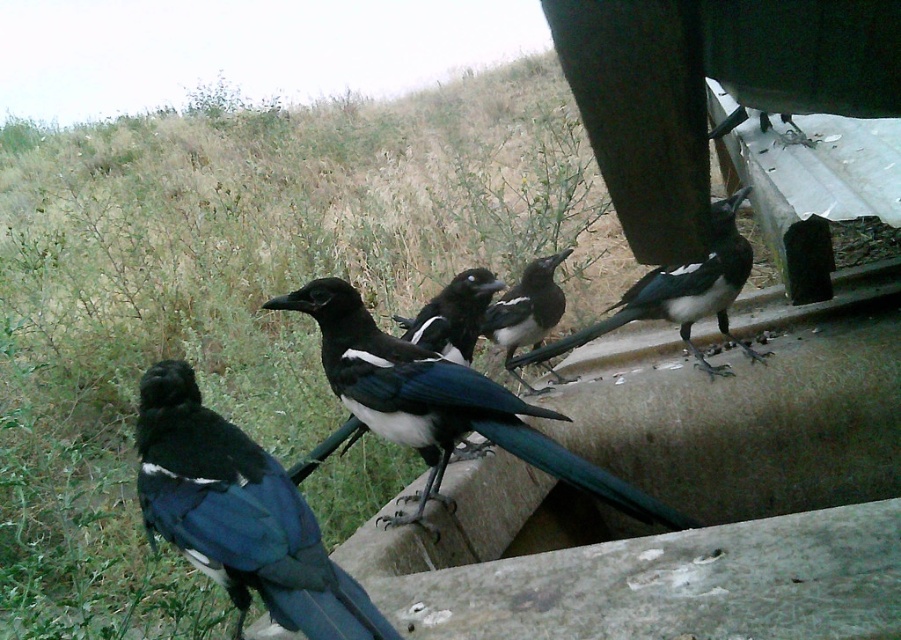
Is matte black magpie at lower left taller than shiny black magpie at center?

No.

Is matte black magpie at lower left smaller than shiny black magpie at center?

Yes, matte black magpie at lower left is smaller than shiny black magpie at center.

At what (x,y) coordinates should I click in order to perform the action: click on matte black magpie at lower left. Please return your answer as a coordinate pair (x, y). Looking at the image, I should click on (239, 515).

Identify the location of matte black magpie at lower left. (239, 515).

Consider the image. Between matte black magpie at lower left and shiny black magpie at upper right, which one is positioned higher?

shiny black magpie at upper right

Is point (162, 452) farther from camera compared to point (517, 358)?

That is False.

Image resolution: width=901 pixels, height=640 pixels. I want to click on matte black magpie at lower left, so click(x=239, y=515).

Is point (359, 390) behind point (734, 266)?

No.

From the picture: Between shiny black magpie at center and shiny black magpie at upper right, which one has less height?

shiny black magpie at center is shorter.

Measure the distance between point [515,401] and camera.

Point [515,401] is 6.30 feet from camera.

You are a GUI agent. You are given a task and a screenshot of the screen. Output one action in this format:
    pyautogui.click(x=<x>, y=<y>)
    Task: Click on the shiny black magpie at center
    
    Given the screenshot: What is the action you would take?
    (x=441, y=404)